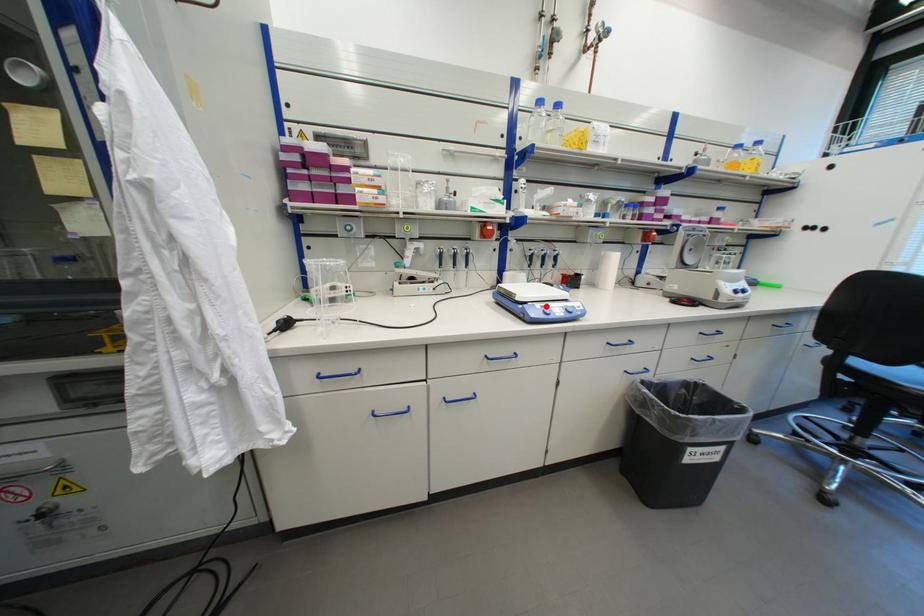
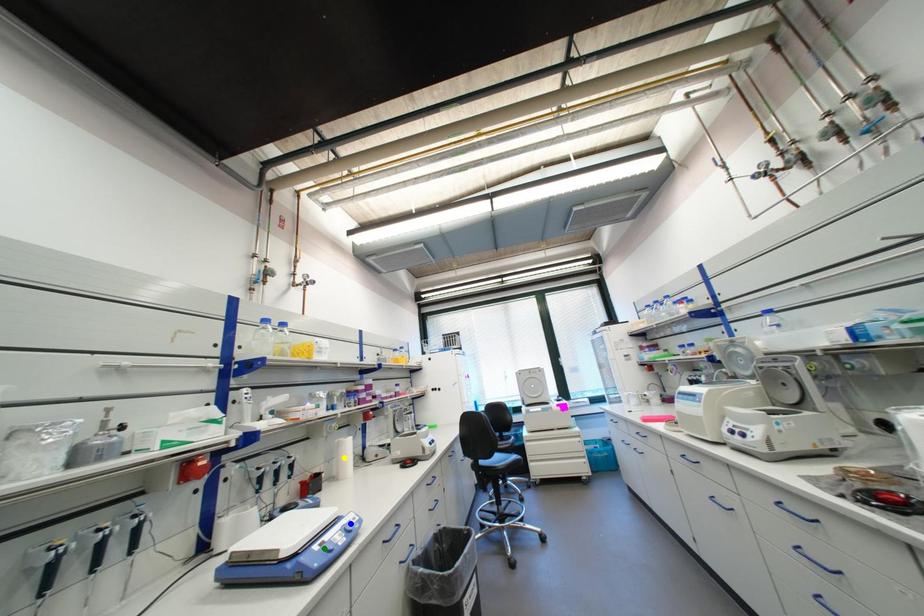
Question: I am providing you with two images of the same scene from different viewpoints. A red point is marked on the first image. You are given multiple points on the second image. Which point in image 2 represents the same 3d spot as the red point in image 1?

Choices:
 (A) yellow point
 (B) green point
 (C) blue point

Answer: (B)